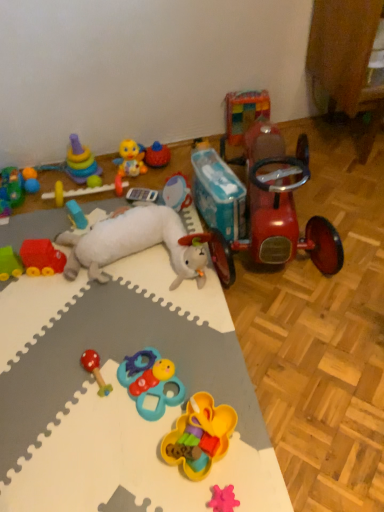
This screenshot has width=384, height=512. In order to click on free space on the front side of shiny red tricycle at right, which is counted as the 1th toy, starting from the right in this screenshot , I will do `click(283, 334)`.